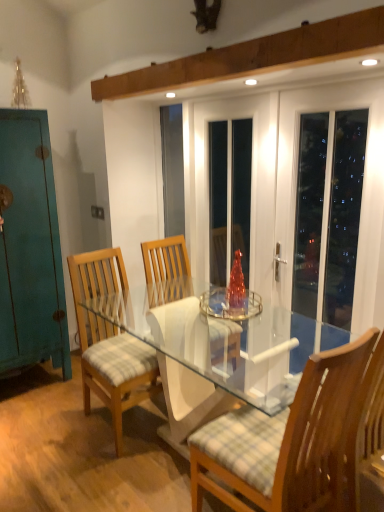
Locate an element on the screen. This screenshot has width=384, height=512. free region under light brown wood chair at center, which ranks as the 2th chair in front-to-back order (from a real-world perspective) is located at coordinates (126, 421).